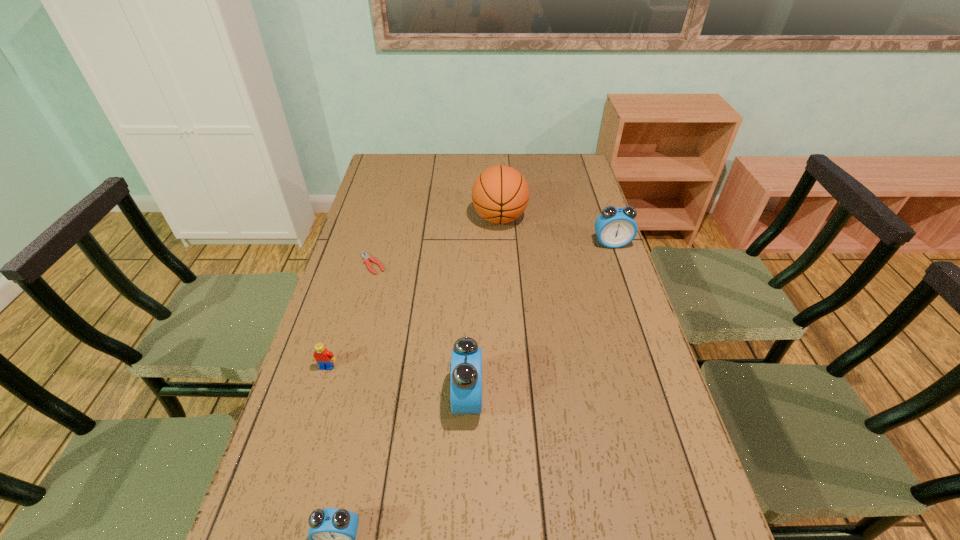
Image resolution: width=960 pixels, height=540 pixels. Find the location of `vacant space positioned 0.270m on the face of the fourth farthest object`. vacant space positioned 0.270m on the face of the fourth farthest object is located at coordinates (294, 476).

Find the location of a particular element. vacant area situated on the left of the basketball is located at coordinates (364, 218).

Find the location of a particular element. The width and height of the screenshot is (960, 540). vacant position located 0.370m on the front of the pliers is located at coordinates (x=343, y=373).

This screenshot has height=540, width=960. What are the coordinates of `Lego that is at the left edge` in the screenshot? It's located at point(324,358).

Locate an element on the screen. This screenshot has height=540, width=960. pliers positioned at the left edge is located at coordinates 366,256.

The height and width of the screenshot is (540, 960). In order to click on object positioned at the right edge in this screenshot , I will do `click(615, 227)`.

You are a GUI agent. You are given a task and a screenshot of the screen. Output one action in this format:
    pyautogui.click(x=<x>, y=<y>)
    Task: Click on the free region at the far edge of the desktop
    The image size is (960, 540).
    Given the screenshot: What is the action you would take?
    pyautogui.click(x=417, y=177)

The width and height of the screenshot is (960, 540). I want to click on vacant space at the left edge of the desktop, so click(x=379, y=217).

Identify the location of vacant area at the right edge of the desktop. The image size is (960, 540). (642, 364).

Image resolution: width=960 pixels, height=540 pixels. What are the coordinates of `empty location between the third nearest object and the farthest object` in the screenshot? It's located at (413, 293).